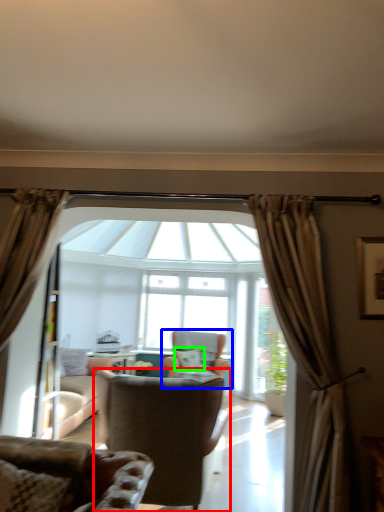
Question: Estimate the real-world distances between objects in this image. Which object is farther from chair (highlighted by a red box), chair (highlighted by a blue box) or pillow (highlighted by a green box)?

Choices:
 (A) chair
 (B) pillow

Answer: (A)